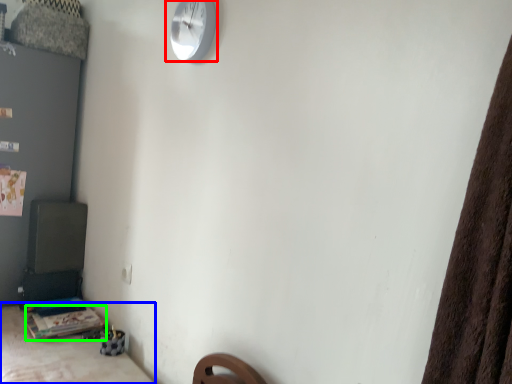
Question: Which object is the closest to the wall clock (highlighted by a red box)? Choose among these: furniture (highlighted by a blue box) or table (highlighted by a green box).

Choices:
 (A) furniture
 (B) table

Answer: (A)